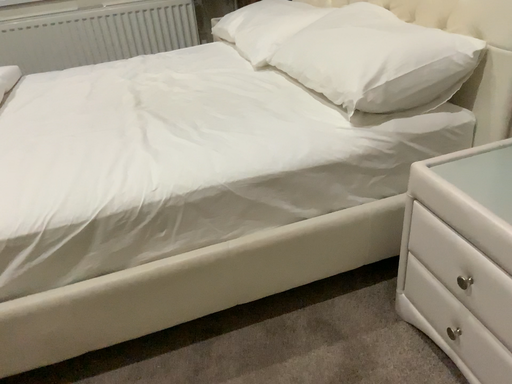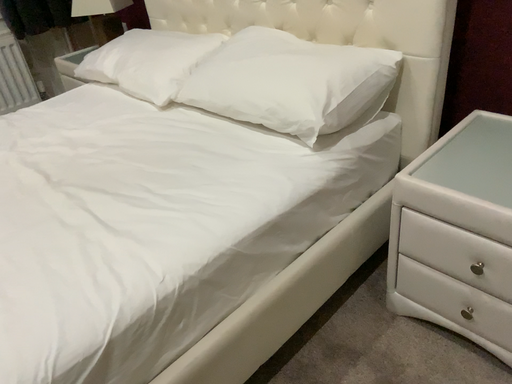
Question: How did the camera likely rotate when shooting the video?

Choices:
 (A) rotated left
 (B) rotated right

Answer: (B)